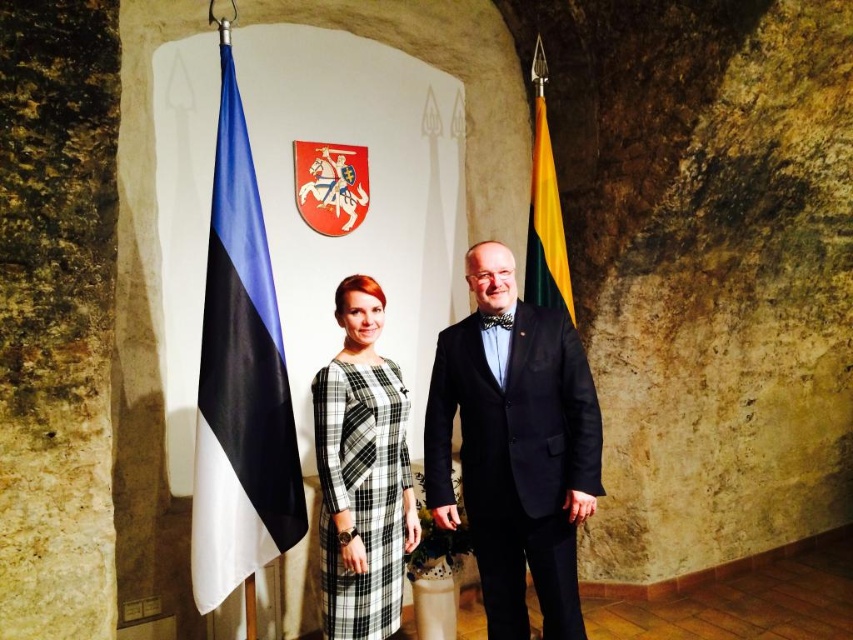
Is black satin suit at center further to the viewer compared to black checkered dress at center?

Yes, it is behind black checkered dress at center.

Does black satin suit at center have a greater width compared to black checkered dress at center?

Yes.

Identify the location of black satin suit at center. (515, 445).

Which of these two, blue/white fabric flag at left or yellow-green fabric flag at right, stands taller?

blue/white fabric flag at left

The image size is (853, 640). In order to click on blue/white fabric flag at left in this screenshot , I will do `click(241, 381)`.

Does black satin suit at center appear on the left side of yellow-green fabric flag at right?

Correct, you'll find black satin suit at center to the left of yellow-green fabric flag at right.

Who is lower down, black satin suit at center or yellow-green fabric flag at right?

black satin suit at center

Is point (483, 417) positioned behind point (552, 276)?

No.

This screenshot has width=853, height=640. What are the coordinates of `black satin suit at center` in the screenshot? It's located at (515, 445).